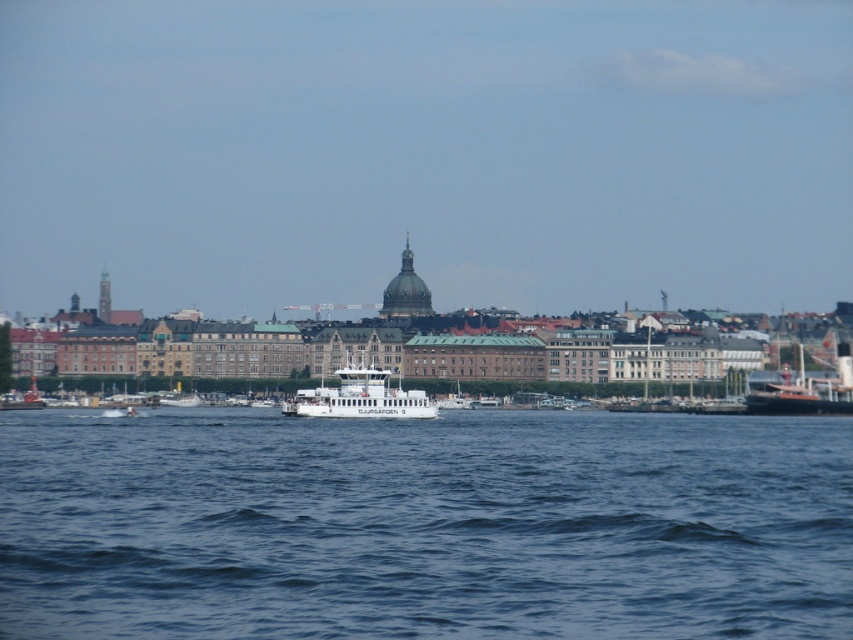
Question: Which point is farther from the camera taking this photo?

Choices:
 (A) (795, 387)
 (B) (318, 461)

Answer: (A)

Question: Which point is farther to the camera?

Choices:
 (A) blue water at center
 (B) white glossy ferry at center

Answer: (B)

Question: From the image, what is the correct spatial relationship of white glossy ferry at center in relation to rustic wooden ship at right?

Choices:
 (A) right
 (B) left

Answer: (B)

Question: Is white glossy ferry at center bigger than rustic wooden ship at right?

Choices:
 (A) yes
 (B) no

Answer: (A)

Question: Does white glossy ferry at center lie in front of rustic wooden ship at right?

Choices:
 (A) yes
 (B) no

Answer: (A)

Question: Estimate the real-world distances between objects in this image. Which object is farther from the blue water at center?

Choices:
 (A) white glossy ferry at center
 (B) rustic wooden ship at right

Answer: (B)